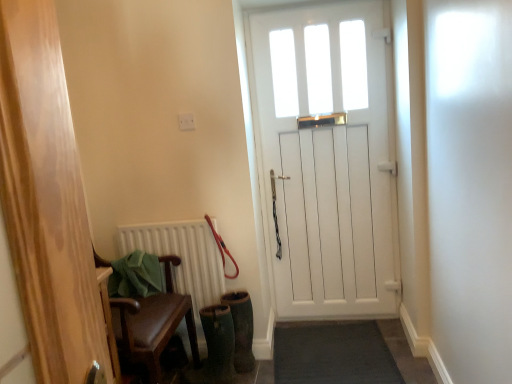
Image resolution: width=512 pixels, height=384 pixels. I want to click on free location above white wooden door at center (from a real-world perspective), so click(x=312, y=4).